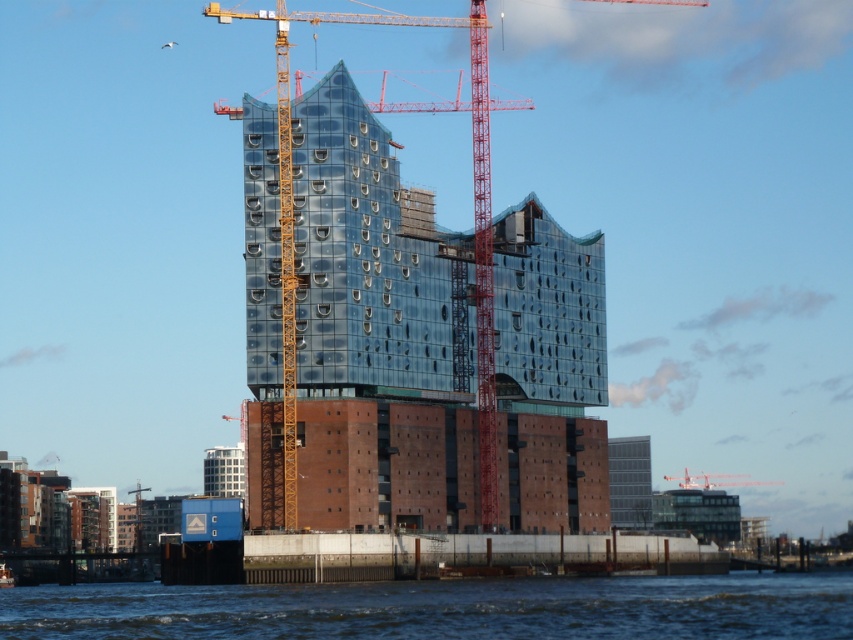
Question: Based on their relative distances, which object is farther from the yellow metal crane at center?

Choices:
 (A) transparent water at lower center
 (B) glassy transparent tower at center

Answer: (B)

Question: From the image, what is the correct spatial relationship of yellow metal crane at center in relation to metallic red crane at center?

Choices:
 (A) above
 (B) below

Answer: (A)

Question: Based on their relative distances, which object is farther from the yellow metal crane at center?

Choices:
 (A) metallic red crane at center
 (B) glassy transparent tower at center

Answer: (A)

Question: Where is yellow metal crane at center located in relation to metallic red crane at center in the image?

Choices:
 (A) above
 (B) below

Answer: (A)

Question: Which of the following is the closest to the observer?

Choices:
 (A) (610, 518)
 (B) (486, 282)
 (C) (752, 484)
 (D) (849, 612)

Answer: (D)

Question: Does yellow metal crane at center have a larger size compared to metallic red crane at center?

Choices:
 (A) no
 (B) yes

Answer: (B)